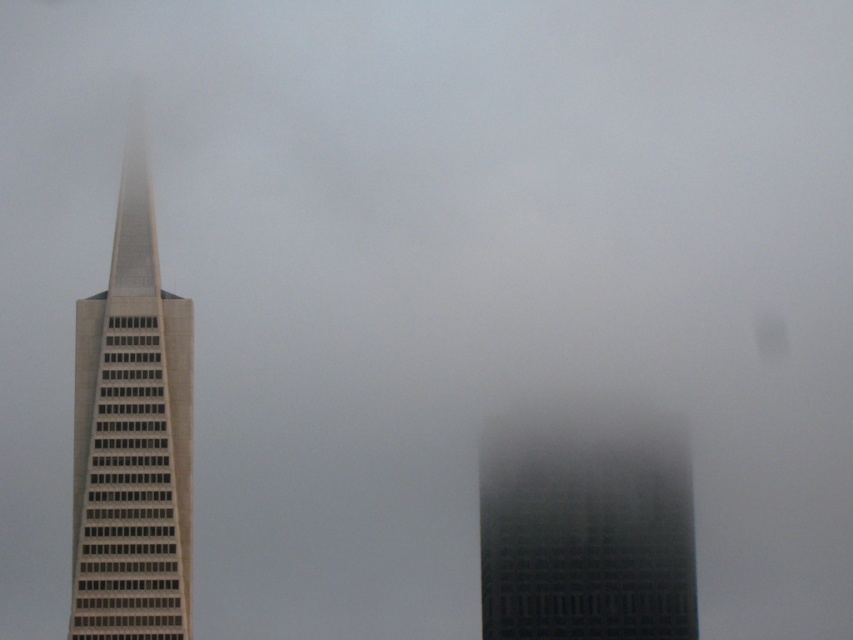
Question: Which object appears closest to the camera in this image?

Choices:
 (A) dark gray glass building at center
 (B) beige glass skyscraper at left

Answer: (B)

Question: Is the position of beige glass skyscraper at left more distant than that of dark gray glass building at center?

Choices:
 (A) no
 (B) yes

Answer: (A)

Question: Is beige glass skyscraper at left wider than dark gray glass building at center?

Choices:
 (A) yes
 (B) no

Answer: (B)

Question: Which object is closer to the camera taking this photo?

Choices:
 (A) dark gray glass building at center
 (B) beige glass skyscraper at left

Answer: (B)

Question: Can you confirm if beige glass skyscraper at left is bigger than dark gray glass building at center?

Choices:
 (A) yes
 (B) no

Answer: (A)

Question: Which of the following is the closest to the observer?

Choices:
 (A) beige glass skyscraper at left
 (B) dark gray glass building at center

Answer: (A)